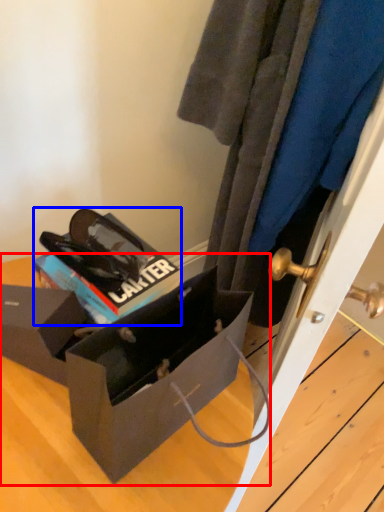
Question: Which object appears farthest to the camera in this image, box (highlighted by a red box) or kit (highlighted by a blue box)?

Choices:
 (A) box
 (B) kit

Answer: (B)